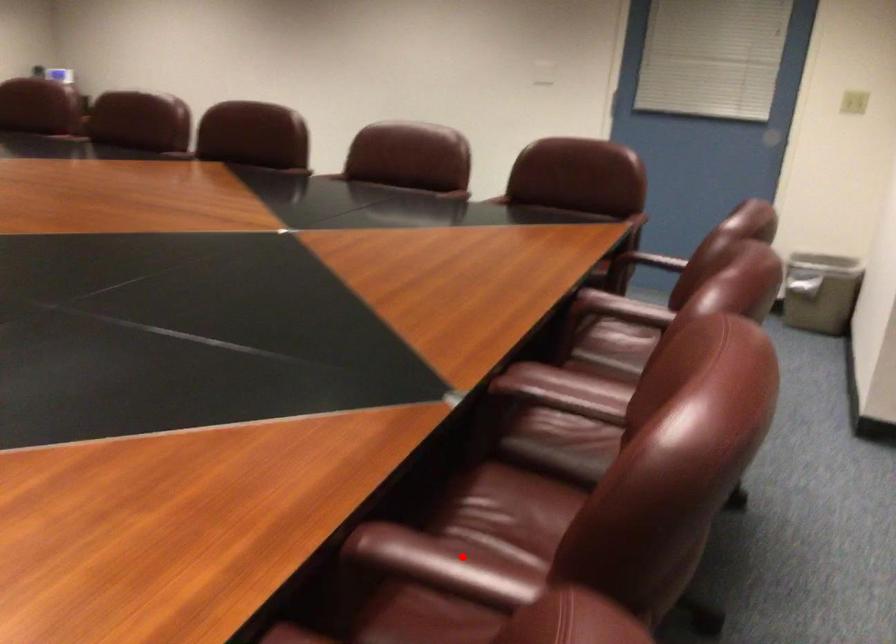
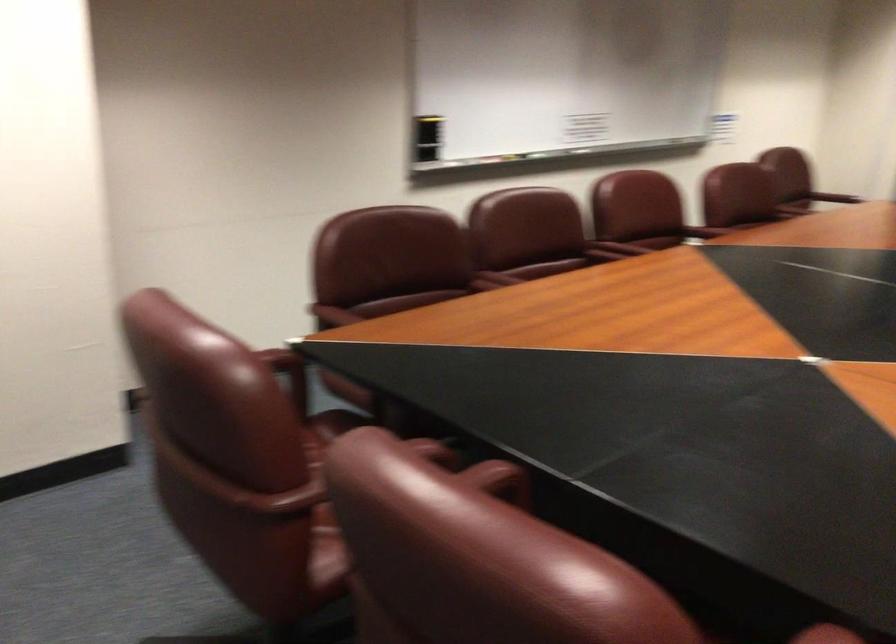
Question: I am providing you with two images of the same scene from different viewpoints. A red point is shown in image1. For the corresponding object point in image2, is it positioned nearer or farther from the camera?

Choices:
 (A) Nearer
 (B) Farther

Answer: (B)